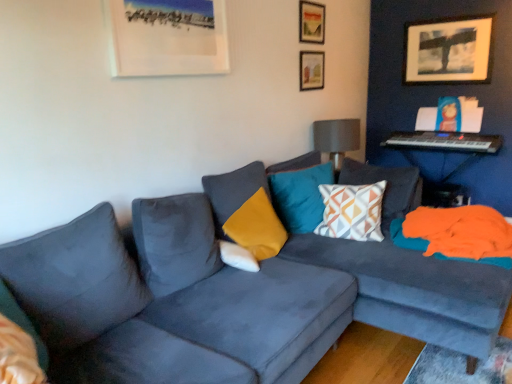
The height and width of the screenshot is (384, 512). Identify the location of free space above wooden picture frame at upper right, which ranks as the 4th picture frame in left-to-right order (from a real-world perspective). click(x=444, y=18).